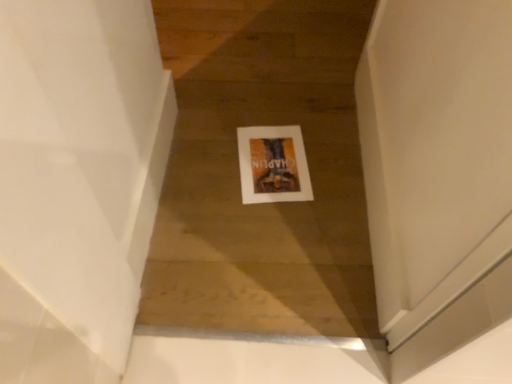
Identify the location of free space in front of white matte picture frame at center. The height and width of the screenshot is (384, 512). click(x=267, y=230).